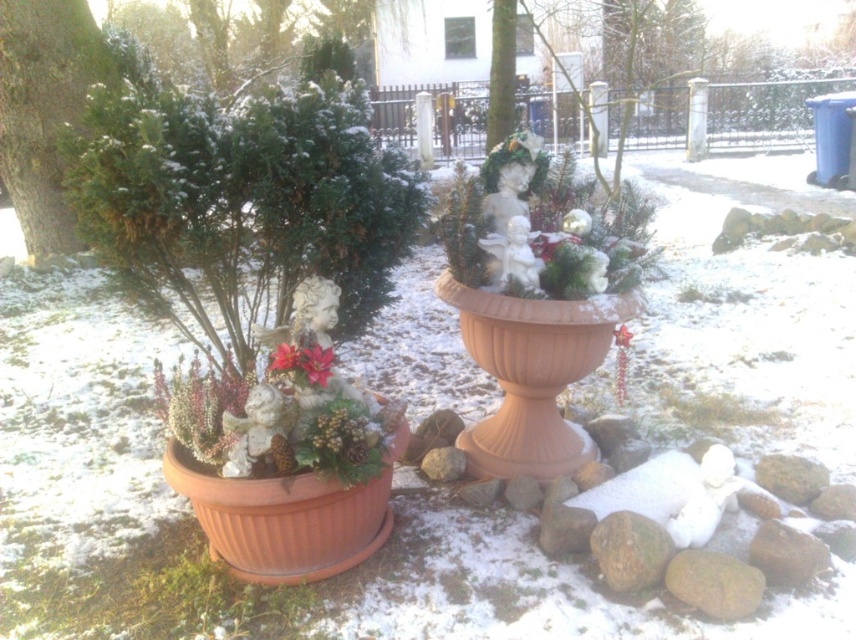
Is green textured evergreen tree at left thinner than poinsettia matte at center?

Incorrect, green textured evergreen tree at left's width is not less than poinsettia matte at center's.

Is green textured evergreen tree at left smaller than poinsettia matte at center?

Actually, green textured evergreen tree at left might be larger than poinsettia matte at center.

Which is in front, point (64, 83) or point (310, 342)?

Positioned in front is point (310, 342).

Locate an element on the screen. This screenshot has width=856, height=640. green textured evergreen tree at left is located at coordinates (45, 109).

Which of these two, poinsettia matte at center or pink matte flower at center, stands shorter?

With less height is pink matte flower at center.

Is point (306, 378) in front of point (272, 369)?

Yes, point (306, 378) is in front of point (272, 369).

Where is `poinsettia matte at center`? This screenshot has height=640, width=856. poinsettia matte at center is located at coordinates (301, 362).

Where is `poinsettia matte at center`? poinsettia matte at center is located at coordinates (301, 362).

Who is higher up, poinsettia matte at center or matte red flower at center?

matte red flower at center is higher up.

The image size is (856, 640). Describe the element at coordinates (301, 362) in the screenshot. I see `poinsettia matte at center` at that location.

Locate an element on the screen. Image resolution: width=856 pixels, height=640 pixels. poinsettia matte at center is located at coordinates (301, 362).